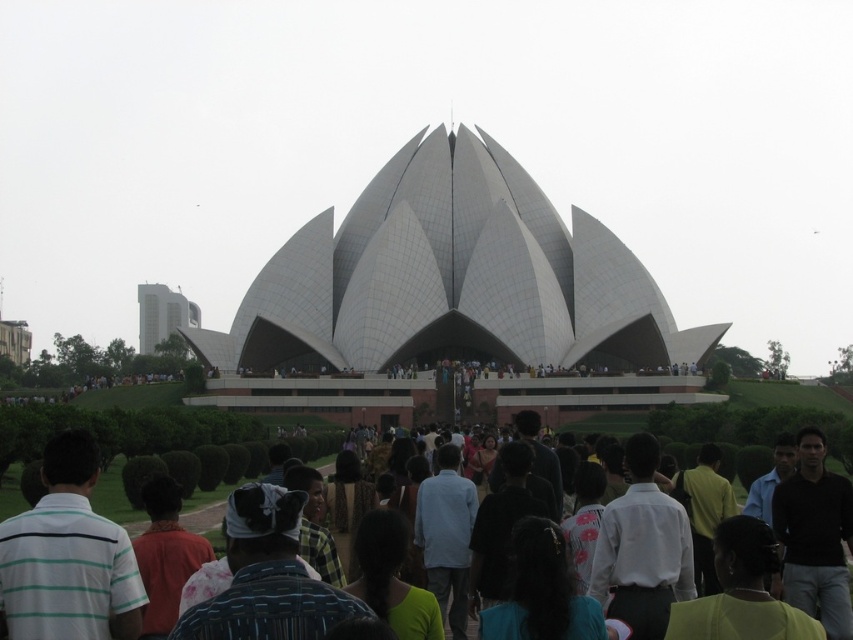
Between white smooth dome at center and white shirt at center, which one is positioned higher?

white smooth dome at center is above.

Who is more forward, (488,337) or (836,442)?

Point (836,442) is more forward.

Between point (409, 211) and point (111, 474), which one is positioned behind?

Point (409, 211)

Locate an element on the screen. white smooth dome at center is located at coordinates (451, 276).